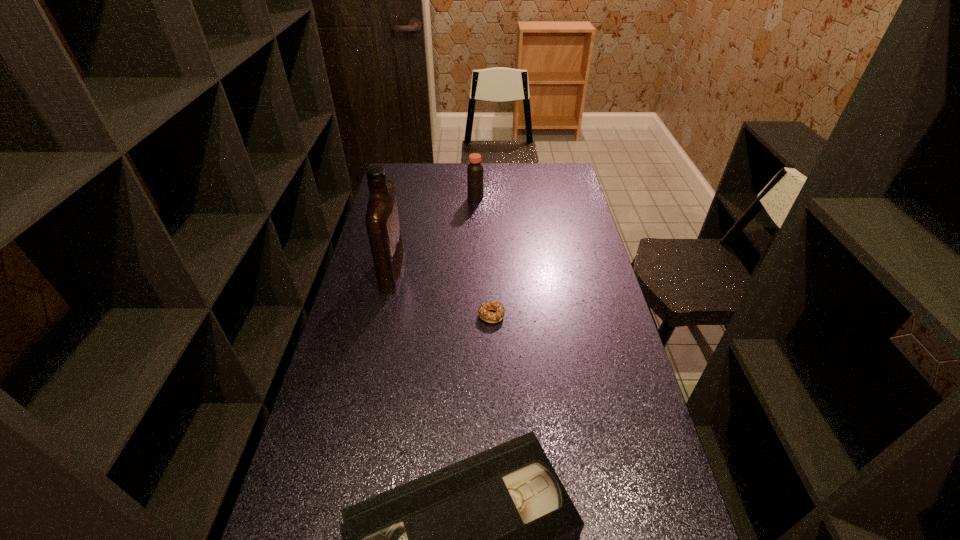
Image resolution: width=960 pixels, height=540 pixels. I want to click on vacant region at the far edge of the desktop, so click(x=430, y=184).

Identify the location of vacant point at the left edge. This screenshot has height=540, width=960. (324, 384).

Identify the location of free region at the right edge of the desktop. (634, 376).

The width and height of the screenshot is (960, 540). Find the location of `free space at the far right corner of the desktop`. free space at the far right corner of the desktop is located at coordinates (573, 180).

You are a GUI agent. You are given a task and a screenshot of the screen. Output one action in this format:
    pyautogui.click(x=<x>, y=<y>)
    Task: Click on the free space between the third shortest object and the third farthest object
    This screenshot has width=960, height=540.
    Given the screenshot: What is the action you would take?
    pyautogui.click(x=483, y=257)

Where is `free space between the liquor and the vinegar`? free space between the liquor and the vinegar is located at coordinates (434, 234).

Find the location of a particular element. The image size is (960, 540). free space between the second farthest object and the shortest object is located at coordinates (442, 293).

Find the location of a particular element. The width and height of the screenshot is (960, 540). free space between the vinegar and the third nearest object is located at coordinates (434, 234).

Identify which object is the nearest to the tallest object. Please provide its 2D coordinates. Your answer should be formatted as a tuple, i.e. [(x, y)], where the tuple contains the x and y coordinates of a point satisfying the conditions above.

[(489, 317)]

In order to click on object that stands as the closest to the nearest object in this screenshot , I will do `click(489, 317)`.